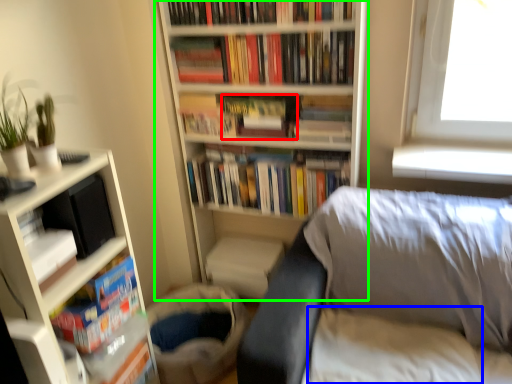
Question: Estimate the real-world distances between objects in this image. Which object is closer to paperback book (highlighted by a red box), sheet (highlighted by a blue box) or bookcase (highlighted by a green box)?

Choices:
 (A) sheet
 (B) bookcase

Answer: (B)